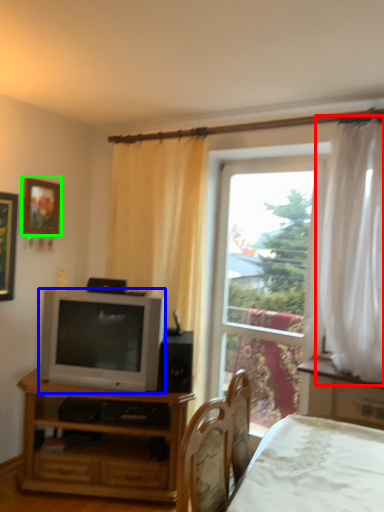
Question: Considering the real-world distances, which object is closest to curtain (highlighted by a red box)? television (highlighted by a blue box) or picture frame (highlighted by a green box).

Choices:
 (A) television
 (B) picture frame

Answer: (A)